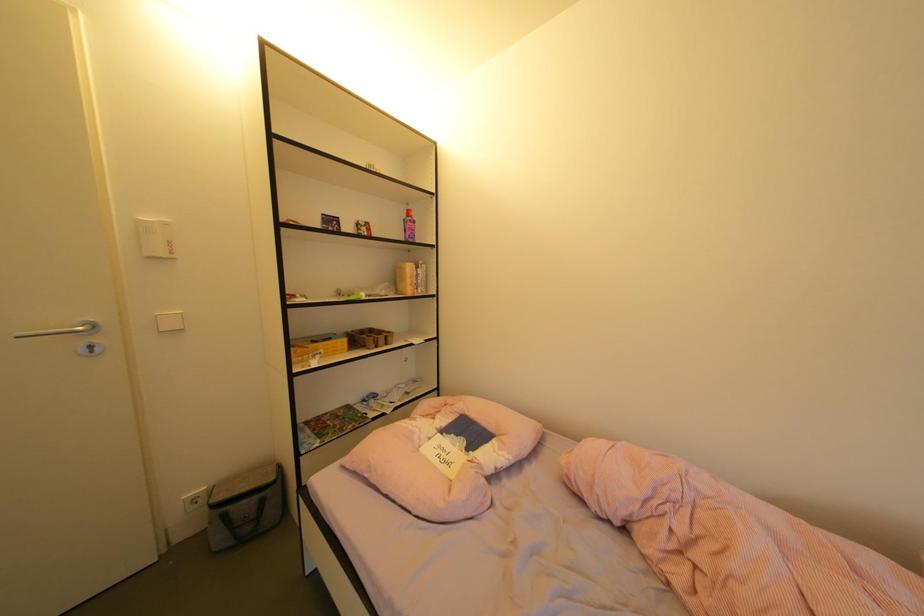
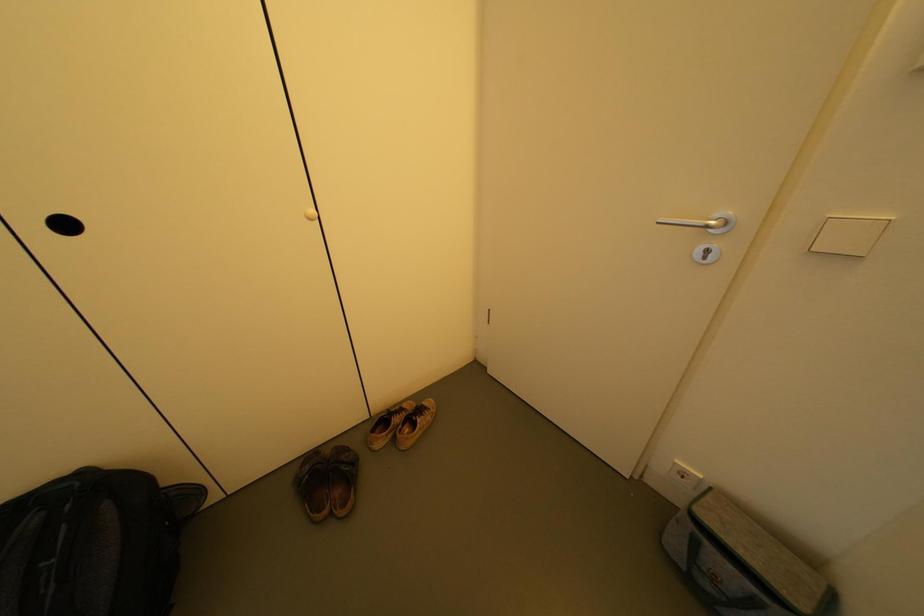
Based on the continuous images, in which direction is the camera rotating?

The camera rotated toward left-down.